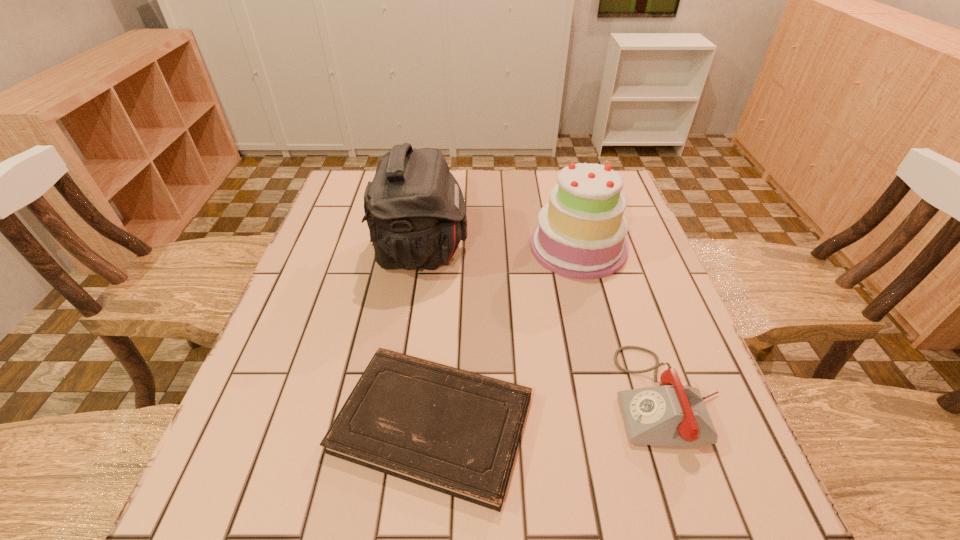
Where is `shoulder bag`? The width and height of the screenshot is (960, 540). shoulder bag is located at coordinates (415, 210).

Where is `cake`? Image resolution: width=960 pixels, height=540 pixels. cake is located at coordinates (581, 233).

Where is `the second shortest object`? Image resolution: width=960 pixels, height=540 pixels. the second shortest object is located at coordinates (672, 414).

The width and height of the screenshot is (960, 540). Identify the location of paperback book. (453, 431).

You are a GUI agent. You are given a task and a screenshot of the screen. Output one action in this format:
    pyautogui.click(x=<x>, y=<y>)
    Task: Click on the vacant space located on the open flap of the tallest object
    This screenshot has width=960, height=540.
    Given the screenshot: What is the action you would take?
    pyautogui.click(x=494, y=251)

Where is `vacant space located 0.210m on the left of the cake`? The width and height of the screenshot is (960, 540). vacant space located 0.210m on the left of the cake is located at coordinates (452, 247).

Identify the location of vacant area situated 0.310m on the dial of the telephone. (454, 396).

Find the location of a particular element. This screenshot has width=960, height=540. free space located on the dial of the telephone is located at coordinates (569, 396).

What are the coordinates of `free space located 0.120m on the dial of the telephone` in the screenshot? It's located at (553, 396).

Identify the location of vacant position located 0.310m on the back of the paperback book. This screenshot has height=540, width=960. (446, 258).